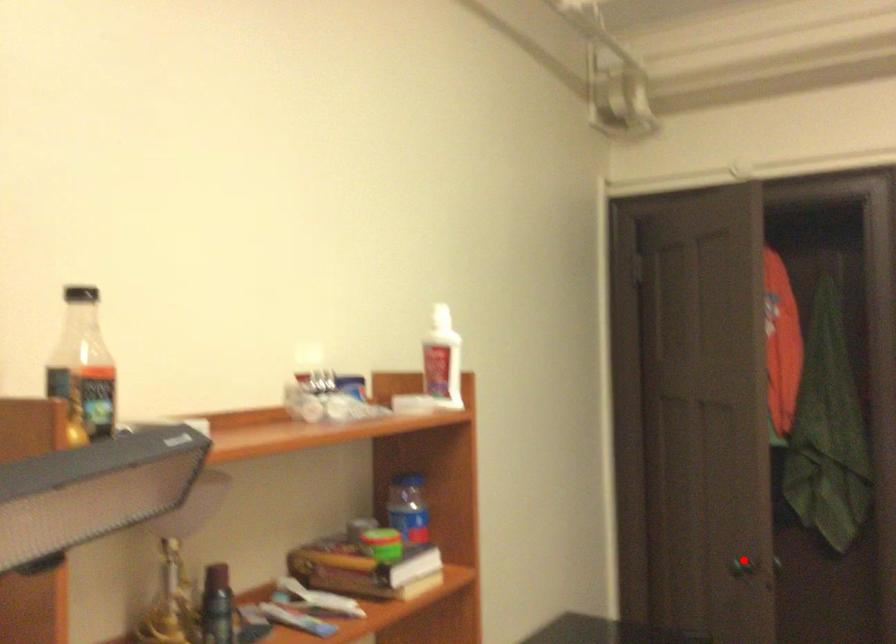
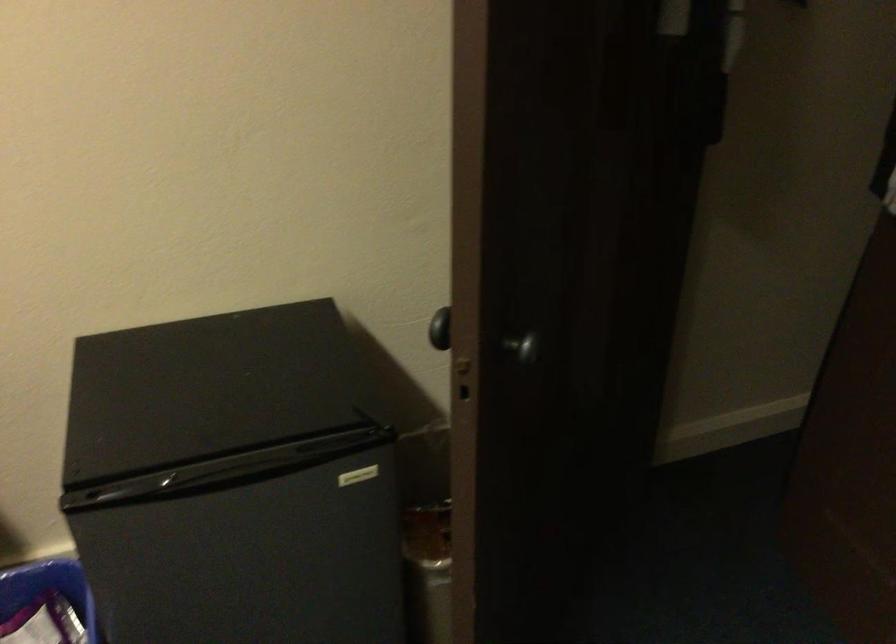
The point at the highlighted location is marked in the first image. Where is the corresponding point in the second image?

(440, 328)